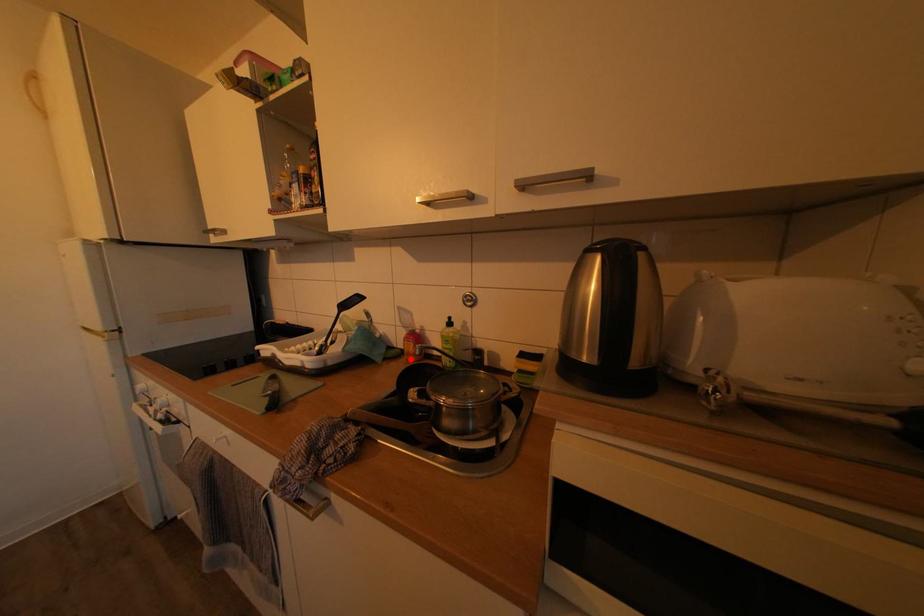
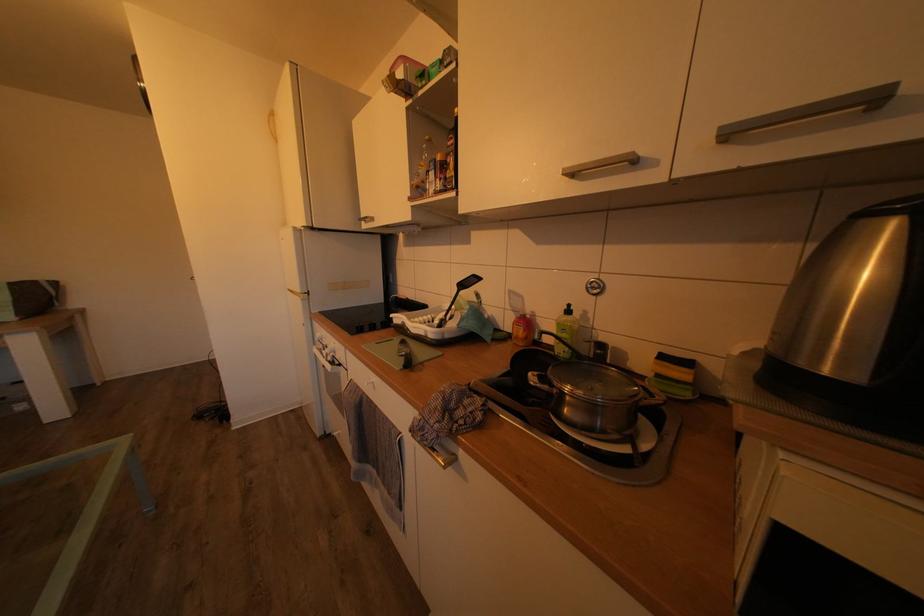
In the second image, find the point that corresponds to the highlighted location in the first image.

(517, 342)